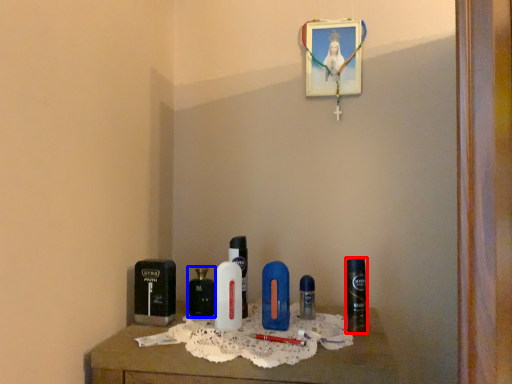
Question: Which of the following is the farthest to the observer, personal care (highlighted by a red box) or perfume (highlighted by a blue box)?

Choices:
 (A) personal care
 (B) perfume

Answer: (B)